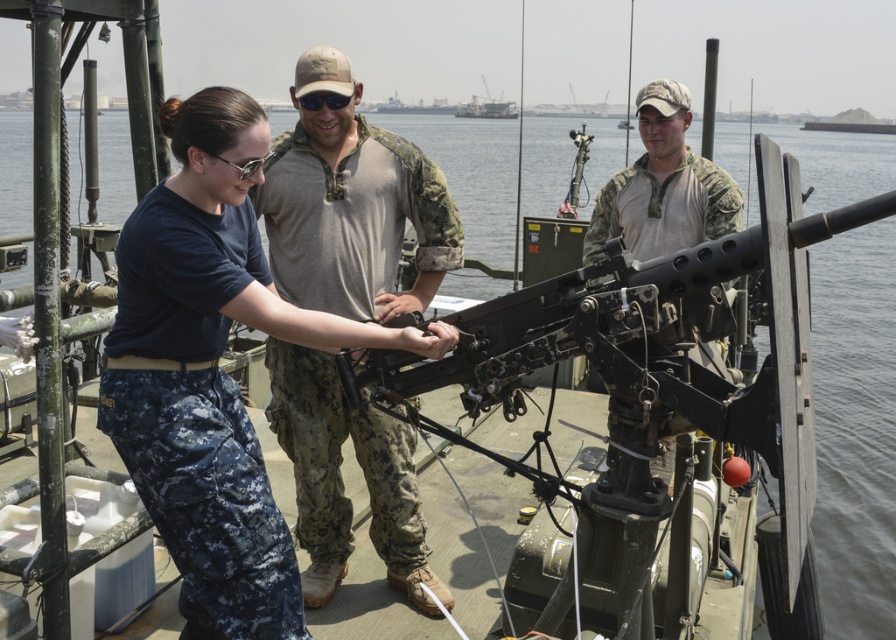
You are a crew member on the ship and need to locate the blue camouflage pants at center. Based on the scene, where would you find them relative to the metallic gray ship at upper center?

The blue camouflage pants at center are located below the metallic gray ship at upper center.

You are a crew member on the ship and need to locate the blue camouflage pants at center and the metallic gray ship at upper center. From your position, which object is closer to the left side?

The blue camouflage pants at center is to the left of the metallic gray ship at upper center, so the blue camouflage pants at center is closer to the left side.

You are standing on the deck of the naval vessel and see two points marked on the deck. The first point is at coordinates point (164, 308) and the second point is at point (488, 109). Which point is closer to you?

Point (164, 308) is closer to the viewer than point (488, 109).